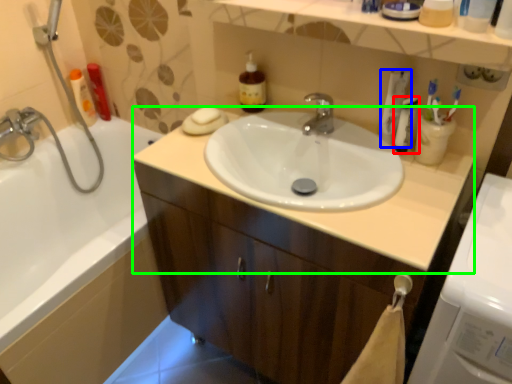
Question: Considering the real-world distances, which object is closest to mouthwash (highlighted by a red box)? toothpaste (highlighted by a blue box) or counter top (highlighted by a green box).

Choices:
 (A) toothpaste
 (B) counter top

Answer: (A)